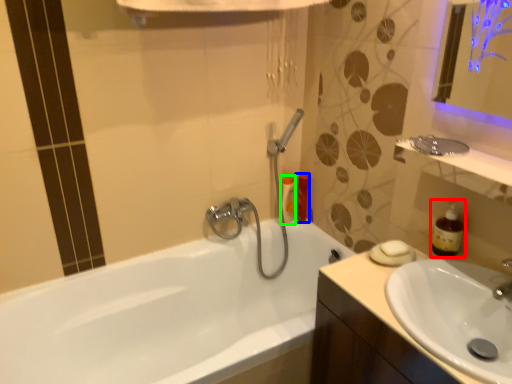
Question: Estimate the real-world distances between objects in this image. Which object is closer to soap dispenser (highlighted by a red box), toiletry (highlighted by a blue box) or toiletry (highlighted by a green box)?

Choices:
 (A) toiletry
 (B) toiletry

Answer: (A)